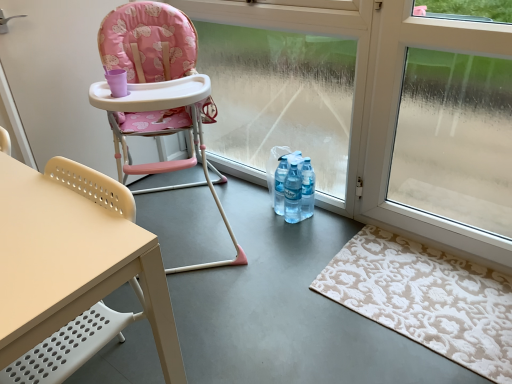
At what (x,y) coordinates should I click in order to perform the action: click on vacant area that is in front of translucent plastic bottles at center. Please return your answer as a coordinate pair (x, y). The image size is (512, 384). Looking at the image, I should click on (294, 235).